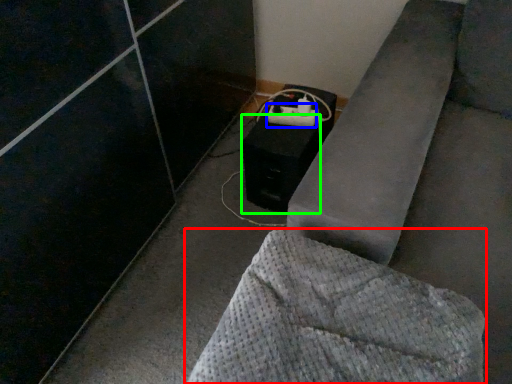
Question: Based on their relative distances, which object is farther from furniture (highlighted by a red box)? Choose from extension cord (highlighted by a blue box) and speaker (highlighted by a green box).

Choices:
 (A) extension cord
 (B) speaker

Answer: (A)